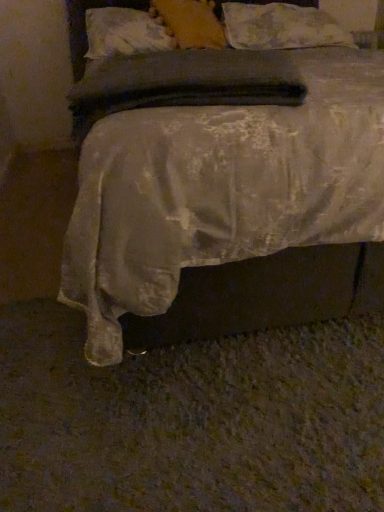
What do you see at coordinates (281, 27) in the screenshot? The width and height of the screenshot is (384, 512). I see `fluffy white pillow at upper center, positioned as the first pillow in right-to-left order` at bounding box center [281, 27].

Image resolution: width=384 pixels, height=512 pixels. What do you see at coordinates (124, 32) in the screenshot?
I see `white textured pillow at upper center, which is counted as the third pillow, starting from the right` at bounding box center [124, 32].

You are a GUI agent. You are given a task and a screenshot of the screen. Output one action in this format:
    pyautogui.click(x=<x>, y=<y>)
    Task: Click on the white textured pillow at upper center, arranged as the first pillow when viewed from the left
    
    Given the screenshot: What is the action you would take?
    pos(124,32)

This screenshot has width=384, height=512. Find the location of `fluffy white pillow at upper center, positioned as the first pillow in right-to-left order`. fluffy white pillow at upper center, positioned as the first pillow in right-to-left order is located at coordinates (281, 27).

Is fluffy white pillow at upper center, positioned as the first pillow in right-to-left order, situated inside silky white bed at center or outside?

fluffy white pillow at upper center, positioned as the first pillow in right-to-left order, is inside silky white bed at center.

Who is bigger, fluffy white pillow at upper center, positioned as the first pillow in right-to-left order, or silky white bed at center?

silky white bed at center is bigger.

From the image's perspective, would you say fluffy white pillow at upper center, which is the third pillow from left to right, is shown under silky white bed at center?

No.

Which is in front, fluffy white pillow at upper center, positioned as the first pillow in right-to-left order, or silky white bed at center?

silky white bed at center.

Which object is positioned more to the left, white textured pillow at upper center, which is counted as the third pillow, starting from the right, or fluffy white pillow at upper center, which is the third pillow from left to right?

Positioned to the left is white textured pillow at upper center, which is counted as the third pillow, starting from the right.

Would you consider white textured pillow at upper center, arranged as the first pillow when viewed from the left, to be distant from fluffy white pillow at upper center, which is the third pillow from left to right?

Actually, white textured pillow at upper center, arranged as the first pillow when viewed from the left, and fluffy white pillow at upper center, which is the third pillow from left to right, are a little close together.

How far apart are white textured pillow at upper center, which is counted as the third pillow, starting from the right, and fluffy white pillow at upper center, positioned as the first pillow in right-to-left order?

They are 22.65 inches apart.

From a real-world perspective, does white textured pillow at upper center, which is counted as the third pillow, starting from the right, sit lower than fluffy white pillow at upper center, positioned as the first pillow in right-to-left order?

No, from a real-world perspective, white textured pillow at upper center, which is counted as the third pillow, starting from the right, is not below fluffy white pillow at upper center, positioned as the first pillow in right-to-left order.

From the image's perspective, starting from the silky white bed at center, which pillow is the 1st one above? Please provide its 2D coordinates.

[(124, 32)]

Considering the relative positions of white textured pillow at upper center, arranged as the first pillow when viewed from the left, and silky white bed at center in the image provided, is white textured pillow at upper center, arranged as the first pillow when viewed from the left, behind silky white bed at center?

Yes, white textured pillow at upper center, arranged as the first pillow when viewed from the left, is further from the viewer.

Is white textured pillow at upper center, which is counted as the third pillow, starting from the right, aimed at silky white bed at center?

Yes, white textured pillow at upper center, which is counted as the third pillow, starting from the right, is turned towards silky white bed at center.

From a real-world perspective, which object rests below the other?

silky white bed at center, from a real-world perspective.

Is soft yellow pillow at upper center, placed as the 2th pillow when sorted from right to left, taller or shorter than silky white bed at center?

In the image, soft yellow pillow at upper center, placed as the 2th pillow when sorted from right to left, appears to be shorter than silky white bed at center.

Considering the points (171, 10) and (156, 142), which point is behind, point (171, 10) or point (156, 142)?

Point (171, 10)

From the image's perspective, which object appears higher, soft yellow pillow at upper center, placed as the 2th pillow when sorted from right to left, or silky white bed at center?

soft yellow pillow at upper center, placed as the 2th pillow when sorted from right to left.

From a real-world perspective, is fluffy white pillow at upper center, which is the third pillow from left to right, above or below white textured pillow at upper center, arranged as the first pillow when viewed from the left?

In terms of real-world spatial position, fluffy white pillow at upper center, which is the third pillow from left to right, is below white textured pillow at upper center, arranged as the first pillow when viewed from the left.

Is fluffy white pillow at upper center, positioned as the first pillow in right-to-left order, in front of or behind white textured pillow at upper center, arranged as the first pillow when viewed from the left, in the image?

fluffy white pillow at upper center, positioned as the first pillow in right-to-left order, is behind white textured pillow at upper center, arranged as the first pillow when viewed from the left.

In terms of size, does fluffy white pillow at upper center, which is the third pillow from left to right, appear bigger or smaller than white textured pillow at upper center, which is counted as the third pillow, starting from the right?

In the image, fluffy white pillow at upper center, which is the third pillow from left to right, appears to be larger than white textured pillow at upper center, which is counted as the third pillow, starting from the right.

Does fluffy white pillow at upper center, positioned as the first pillow in right-to-left order, contain white textured pillow at upper center, arranged as the first pillow when viewed from the left?

No, fluffy white pillow at upper center, positioned as the first pillow in right-to-left order, does not contain white textured pillow at upper center, arranged as the first pillow when viewed from the left.

Can you tell me how much fluffy white pillow at upper center, positioned as the first pillow in right-to-left order, and soft yellow pillow at upper center, which is the 2th pillow in left-to-right order, differ in facing direction?

The angle between the facing direction of fluffy white pillow at upper center, positioned as the first pillow in right-to-left order, and the facing direction of soft yellow pillow at upper center, which is the 2th pillow in left-to-right order, is 18.1 degrees.

Looking at this image, is fluffy white pillow at upper center, which is the third pillow from left to right, looking in the opposite direction of soft yellow pillow at upper center, which is the 2th pillow in left-to-right order?

fluffy white pillow at upper center, which is the third pillow from left to right, is not turned away from soft yellow pillow at upper center, which is the 2th pillow in left-to-right order.

Does fluffy white pillow at upper center, which is the third pillow from left to right, appear on the left side of soft yellow pillow at upper center, placed as the 2th pillow when sorted from right to left?

No, fluffy white pillow at upper center, which is the third pillow from left to right, is not to the left of soft yellow pillow at upper center, placed as the 2th pillow when sorted from right to left.

Are fluffy white pillow at upper center, positioned as the first pillow in right-to-left order, and soft yellow pillow at upper center, placed as the 2th pillow when sorted from right to left, making contact?

fluffy white pillow at upper center, positioned as the first pillow in right-to-left order, and soft yellow pillow at upper center, placed as the 2th pillow when sorted from right to left, are not in contact.

From the image's perspective, between white textured pillow at upper center, which is counted as the third pillow, starting from the right, and soft yellow pillow at upper center, which is the 2th pillow in left-to-right order, who is located below?

From the image's view, white textured pillow at upper center, which is counted as the third pillow, starting from the right, is below.

Considering the sizes of objects white textured pillow at upper center, arranged as the first pillow when viewed from the left, and soft yellow pillow at upper center, placed as the 2th pillow when sorted from right to left, in the image provided, who is shorter, white textured pillow at upper center, arranged as the first pillow when viewed from the left, or soft yellow pillow at upper center, placed as the 2th pillow when sorted from right to left,?

white textured pillow at upper center, arranged as the first pillow when viewed from the left, is shorter.

From the picture: Is white textured pillow at upper center, which is counted as the third pillow, starting from the right, positioned with its back to soft yellow pillow at upper center, placed as the 2th pillow when sorted from right to left?

Yes.

Where is `bed in front of the fluffy white pillow at upper center, positioned as the first pillow in right-to-left order`? The width and height of the screenshot is (384, 512). bed in front of the fluffy white pillow at upper center, positioned as the first pillow in right-to-left order is located at coordinates (221, 188).

Identify the location of pillow beneath the white textured pillow at upper center, arranged as the first pillow when viewed from the left (from a real-world perspective). The image size is (384, 512). (281, 27).

Based on their spatial positions, is white textured pillow at upper center, which is counted as the third pillow, starting from the right, or fluffy white pillow at upper center, positioned as the first pillow in right-to-left order, closer to silky white bed at center?

fluffy white pillow at upper center, positioned as the first pillow in right-to-left order.

When comparing their distances from silky white bed at center, does fluffy white pillow at upper center, positioned as the first pillow in right-to-left order, or soft yellow pillow at upper center, which is the 2th pillow in left-to-right order, seem closer?

The object closer to silky white bed at center is soft yellow pillow at upper center, which is the 2th pillow in left-to-right order.

When comparing their distances from silky white bed at center, does soft yellow pillow at upper center, which is the 2th pillow in left-to-right order, or white textured pillow at upper center, which is counted as the third pillow, starting from the right, seem further?

The object further to silky white bed at center is white textured pillow at upper center, which is counted as the third pillow, starting from the right.

Based on their spatial positions, is white textured pillow at upper center, arranged as the first pillow when viewed from the left, or soft yellow pillow at upper center, placed as the 2th pillow when sorted from right to left, closer to fluffy white pillow at upper center, positioned as the first pillow in right-to-left order?

soft yellow pillow at upper center, placed as the 2th pillow when sorted from right to left, is positioned closer to the anchor fluffy white pillow at upper center, positioned as the first pillow in right-to-left order.

Estimate the real-world distances between objects in this image. Which object is closer to silky white bed at center, fluffy white pillow at upper center, which is the third pillow from left to right, or white textured pillow at upper center, arranged as the first pillow when viewed from the left?

fluffy white pillow at upper center, which is the third pillow from left to right, lies closer to silky white bed at center than the other object.

Looking at the image, which one is located closer to soft yellow pillow at upper center, placed as the 2th pillow when sorted from right to left, white textured pillow at upper center, arranged as the first pillow when viewed from the left, or fluffy white pillow at upper center, which is the third pillow from left to right?

white textured pillow at upper center, arranged as the first pillow when viewed from the left, is positioned closer to the anchor soft yellow pillow at upper center, placed as the 2th pillow when sorted from right to left.

When comparing their distances from fluffy white pillow at upper center, positioned as the first pillow in right-to-left order, does white textured pillow at upper center, which is counted as the third pillow, starting from the right, or silky white bed at center seem further?

silky white bed at center lies further to fluffy white pillow at upper center, positioned as the first pillow in right-to-left order, than the other object.

Which object lies nearer to the anchor point soft yellow pillow at upper center, which is the 2th pillow in left-to-right order, fluffy white pillow at upper center, which is the third pillow from left to right, or white textured pillow at upper center, which is counted as the third pillow, starting from the right?

white textured pillow at upper center, which is counted as the third pillow, starting from the right, is positioned closer to the anchor soft yellow pillow at upper center, which is the 2th pillow in left-to-right order.

This screenshot has width=384, height=512. What are the coordinates of `pillow situated between white textured pillow at upper center, which is counted as the third pillow, starting from the right, and fluffy white pillow at upper center, which is the third pillow from left to right, from left to right` in the screenshot? It's located at (191, 23).

Find the location of `pillow between silky white bed at center and white textured pillow at upper center, which is counted as the third pillow, starting from the right, from front to back`. pillow between silky white bed at center and white textured pillow at upper center, which is counted as the third pillow, starting from the right, from front to back is located at coordinates (191, 23).